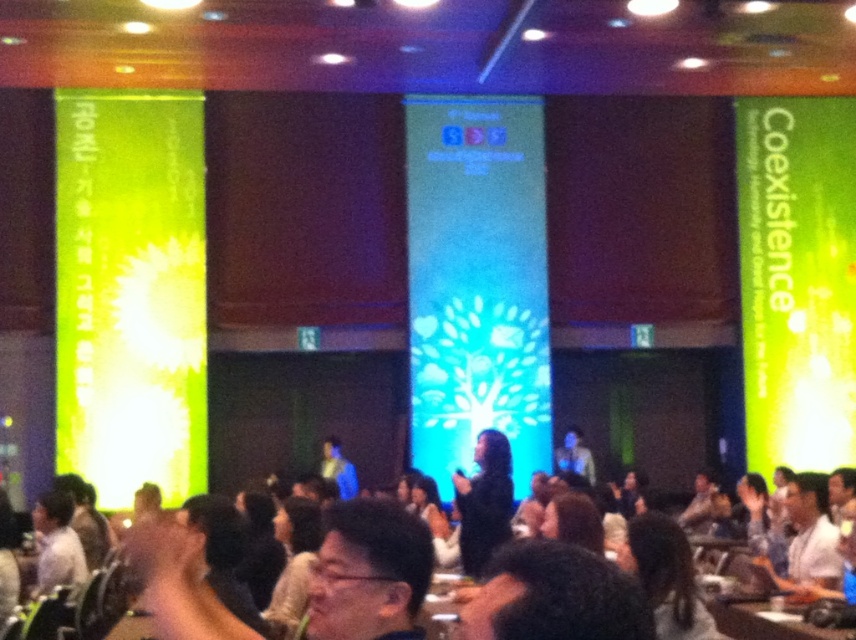
Question: Which of the following is the farthest from the observer?

Choices:
 (A) (495, 440)
 (B) (132, 531)

Answer: (B)

Question: Does dark hair at center appear over black matte dress at center?

Choices:
 (A) no
 (B) yes

Answer: (A)

Question: Does dark hair at center appear under black matte dress at center?

Choices:
 (A) no
 (B) yes

Answer: (B)

Question: Is dark hair at center to the left of black matte dress at center from the viewer's perspective?

Choices:
 (A) yes
 (B) no

Answer: (A)